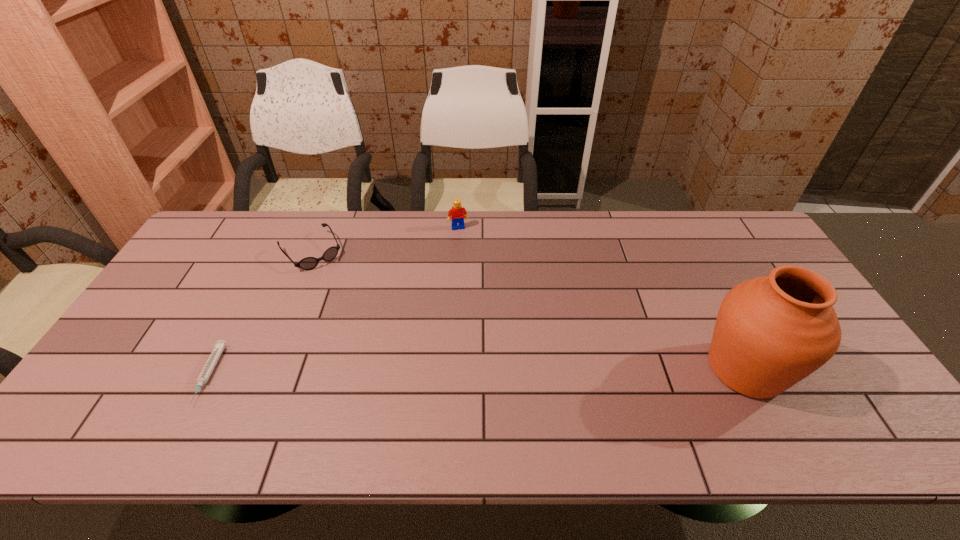
You are a GUI agent. You are given a task and a screenshot of the screen. Output one action in this format:
    pyautogui.click(x=<x>, y=<y>)
    Task: Click on the syringe
    
    Given the screenshot: What is the action you would take?
    pyautogui.click(x=207, y=370)

Identify the location of the shortest object. The image size is (960, 540). (207, 370).

Image resolution: width=960 pixels, height=540 pixels. I want to click on urn, so click(771, 332).

I want to click on the rightmost object, so click(x=771, y=332).

Identify the location of sunglasses. (308, 263).

At what (x,y) coordinates should I click in order to perform the action: click on the second shortest object. Please return your answer as a coordinate pair (x, y). Image resolution: width=960 pixels, height=540 pixels. Looking at the image, I should click on (308, 263).

At what (x,y) coordinates should I click in order to perform the action: click on the farthest object. Please return your answer as a coordinate pair (x, y). Looking at the image, I should click on (457, 213).

Where is `the third object from left to right`? The image size is (960, 540). the third object from left to right is located at coordinates (457, 213).

Identify the location of vacant space positioned 0.270m on the left of the rightmost object. (592, 369).

Locate an element on the screen. The image size is (960, 540). free space located on the lenses of the sunglasses is located at coordinates (372, 329).